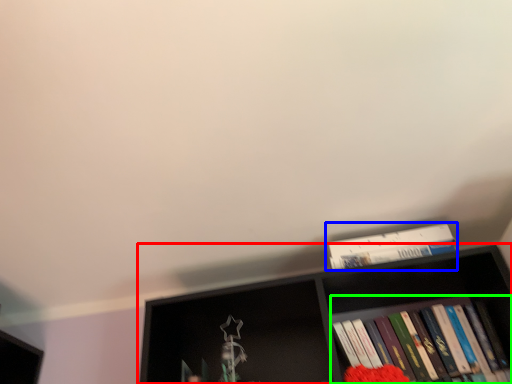
Question: Which object is the farthest from shelf (highlighted by a red box)? Choose among these: book (highlighted by a blue box) or book (highlighted by a green box).

Choices:
 (A) book
 (B) book

Answer: (A)